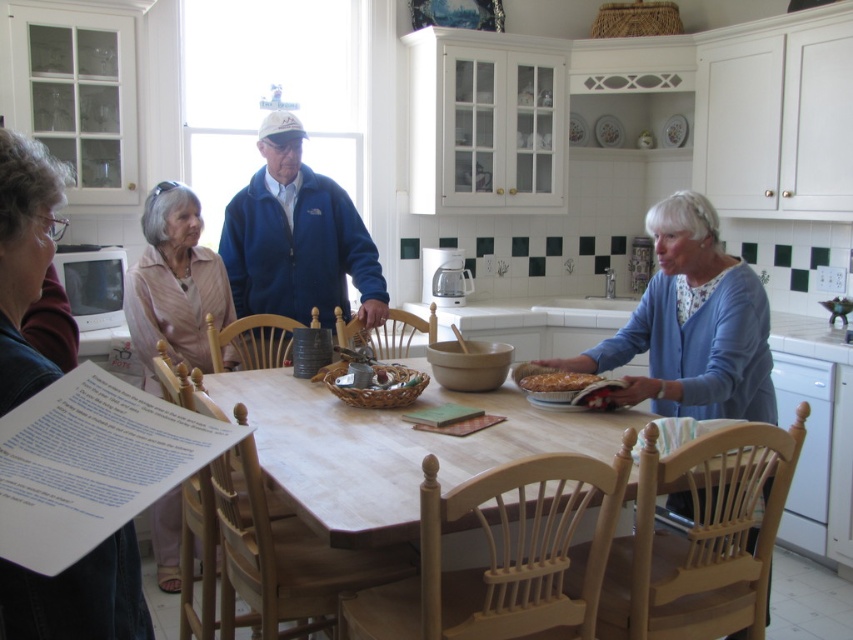
You are a chef preparing to take a photo of the gray hair at upper left and the golden flaky pastry at center for a menu. Which object should you focus on first if you want to capture both in a single frame without moving the camera?

The gray hair at upper left should be focused on first because it is larger than the golden flaky pastry at center, so ensuring it fits properly will help in framing both objects effectively.

You are organizing a charity event and need to place two blue jackets on a display table. You have a blue fabric jacket at center and a blue fleece jacket at center. According to the image, which jacket should be placed to the left to maintain the original arrangement?

The blue fleece jacket at center should be placed to the left since the blue fabric jacket at center is to the right of it in the original image.